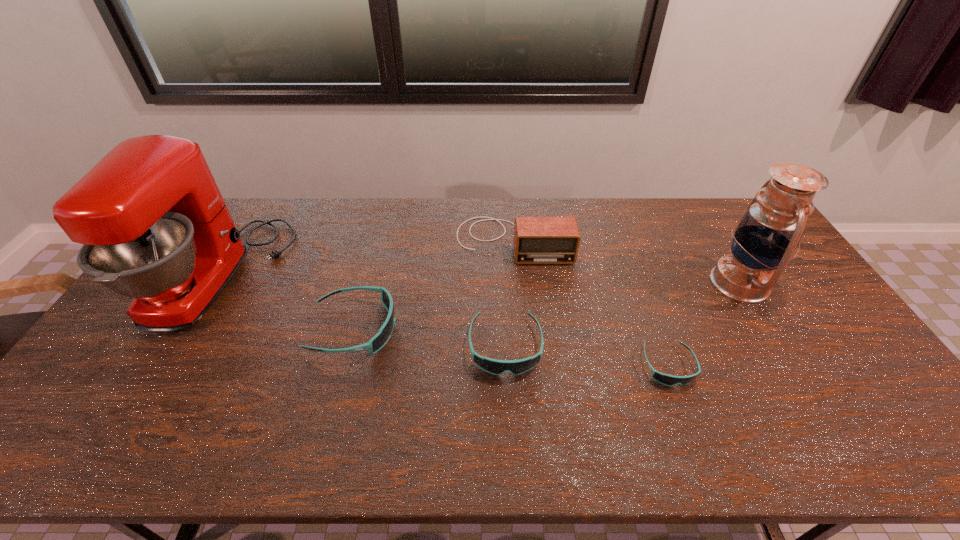
The width and height of the screenshot is (960, 540). I want to click on free location at the near edge of the desktop, so click(504, 408).

Where is `free region at the left edge of the desktop`? The width and height of the screenshot is (960, 540). free region at the left edge of the desktop is located at coordinates (165, 332).

The width and height of the screenshot is (960, 540). In the image, there is a desktop. What are the coordinates of `blank space at the right edge` in the screenshot? It's located at (813, 322).

What are the coordinates of `free space between the oil lamp and the leftmost object` in the screenshot? It's located at (481, 280).

At what (x,y) coordinates should I click in order to perform the action: click on unoccupied area between the shortest sunglasses and the second object from left to right. Please return your answer as a coordinate pair (x, y). The height and width of the screenshot is (540, 960). Looking at the image, I should click on (511, 347).

Locate an element on the screen. This screenshot has width=960, height=540. empty space that is in between the kitchen mixer and the third tallest object is located at coordinates (367, 259).

At what (x,y) coordinates should I click in order to perform the action: click on free space between the rightmost sunglasses and the leftmost sunglasses. Please return your answer as a coordinate pair (x, y). Looking at the image, I should click on (511, 347).

Locate an element on the screen. This screenshot has width=960, height=540. vacant space in between the kitchen mixer and the fifth object from right to left is located at coordinates (287, 303).

The image size is (960, 540). What are the coordinates of `vacant space that's between the leftmost sunglasses and the kitchen mixer` in the screenshot? It's located at (287, 303).

At what (x,y) coordinates should I click in order to perform the action: click on free area in between the leftmost object and the fourth shortest object. Please return your answer as a coordinate pair (x, y). Looking at the image, I should click on (367, 259).